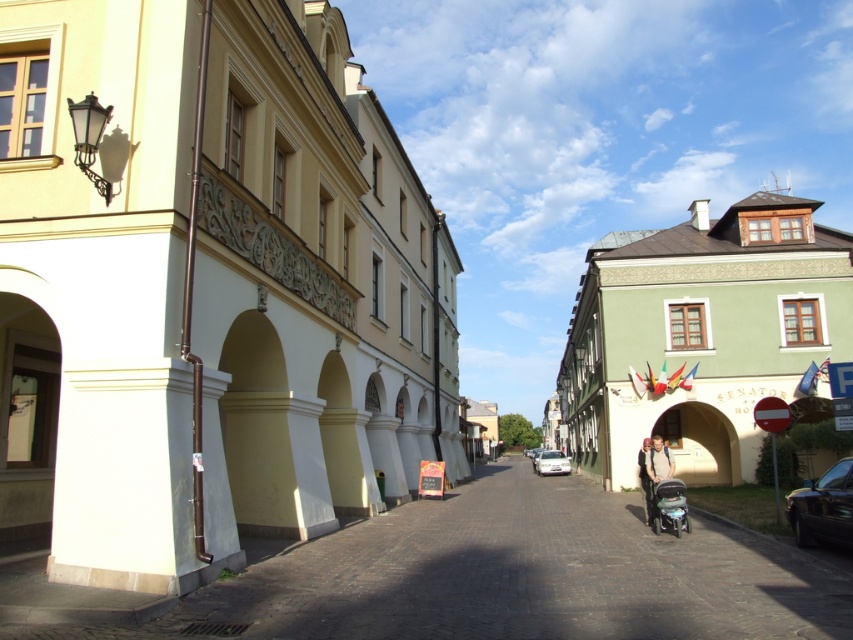
Question: Is shiny black car at right below white glossy car at center?

Choices:
 (A) yes
 (B) no

Answer: (B)

Question: Does beige stone archway at center have a greater width compared to metallic silver motorcycle at lower right?

Choices:
 (A) yes
 (B) no

Answer: (A)

Question: Which point is farther to the camera?

Choices:
 (A) white glossy car at center
 (B) smooth stone alley at center

Answer: (A)

Question: Which point is farther from the camera taking this photo?

Choices:
 (A) (656, 499)
 (B) (714, 483)
 (C) (549, 456)

Answer: (C)

Question: From the image, what is the correct spatial relationship of shiny black car at right in relation to white glossy car at center?

Choices:
 (A) below
 (B) above

Answer: (B)

Question: Which object is farther from the camera taking this photo?

Choices:
 (A) shiny black car at right
 (B) beige stone archway at center
 (C) smooth stone alley at center

Answer: (B)